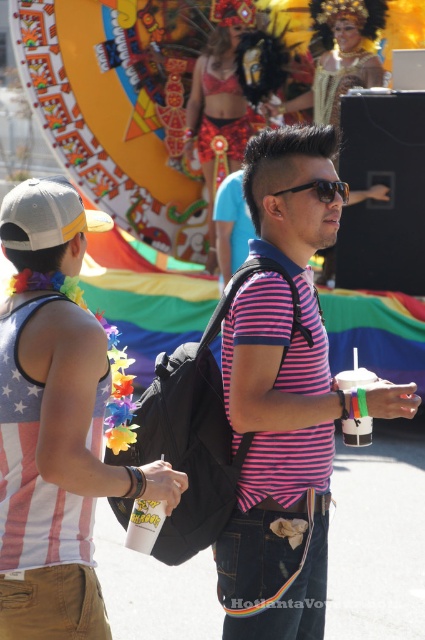
Can you confirm if gray fabric baseball cap at left is thinner than sunglasses at center?

No.

Who is shorter, gray fabric baseball cap at left or sunglasses at center?

Standing shorter between the two is sunglasses at center.

Locate an element on the screen. gray fabric baseball cap at left is located at coordinates (48, 214).

Based on the photo, can you confirm if pink striped polo shirt at center is positioned above sunglasses at center?

No, pink striped polo shirt at center is not above sunglasses at center.

Is pink striped polo shirt at center smaller than sunglasses at center?

No.

Locate an element on the screen. The height and width of the screenshot is (640, 425). pink striped polo shirt at center is located at coordinates (285, 394).

Is american flag tank top at left to the right of shiny red bikini at upper center from the viewer's perspective?

Incorrect, american flag tank top at left is not on the right side of shiny red bikini at upper center.

Identify the location of american flag tank top at left. (56, 426).

Looking at this image, who is more distant from viewer, (22, 204) or (218, 116)?

Positioned behind is point (218, 116).

Locate an element on the screen. Image resolution: width=425 pixels, height=640 pixels. american flag tank top at left is located at coordinates (56, 426).